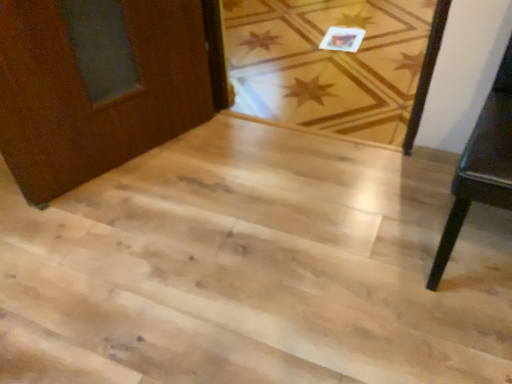
You are a GUI agent. You are given a task and a screenshot of the screen. Output one action in this format:
    pyautogui.click(x=<x>, y=<y>)
    Task: Click on the free space to the back side of dark wood table at right
    The height and width of the screenshot is (384, 512).
    Given the screenshot: What is the action you would take?
    pyautogui.click(x=391, y=168)